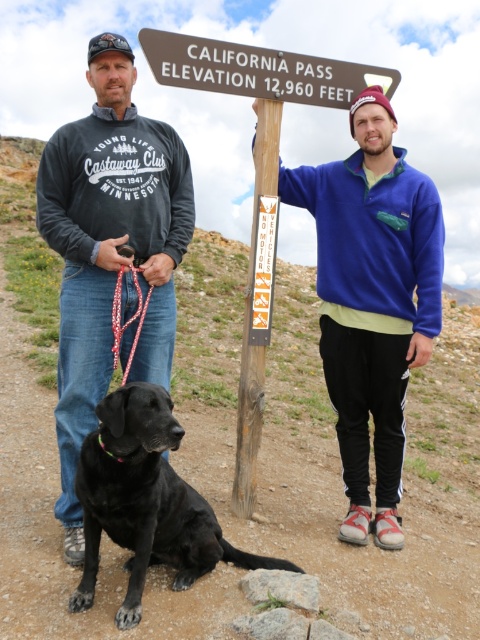
Question: Which point appears closest to the camera in this image?

Choices:
 (A) (275, 60)
 (B) (137, 291)
 (C) (182, 212)
 (D) (98, 516)

Answer: (D)

Question: Is blue fleece jacket at center further to camera compared to shiny black dog at center?

Choices:
 (A) no
 (B) yes

Answer: (B)

Question: Which of the following is the farthest from the observer?

Choices:
 (A) (67, 506)
 (B) (156, 74)
 (C) (117, 326)

Answer: (B)

Question: Among these objects, which one is nearest to the camera?

Choices:
 (A) blue fleece jacket at center
 (B) matte gray hoodie at left

Answer: (B)

Question: Does matte gray hoodie at left appear on the right side of wooden signpost at center?

Choices:
 (A) no
 (B) yes

Answer: (A)

Question: Can you confirm if shiny black dog at center is thinner than wooden signpost at center?

Choices:
 (A) no
 (B) yes

Answer: (A)